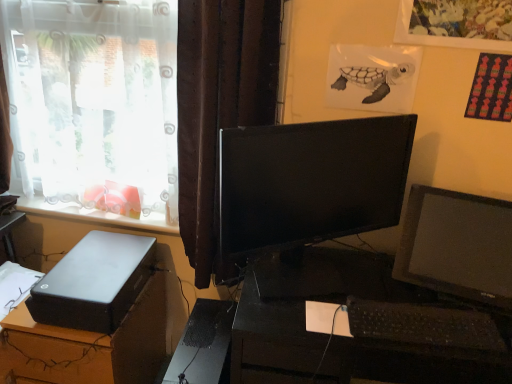
Identify the location of blank space situated above black plastic keyboard at lower right (from a real-world perspective). The image size is (512, 384). (416, 314).